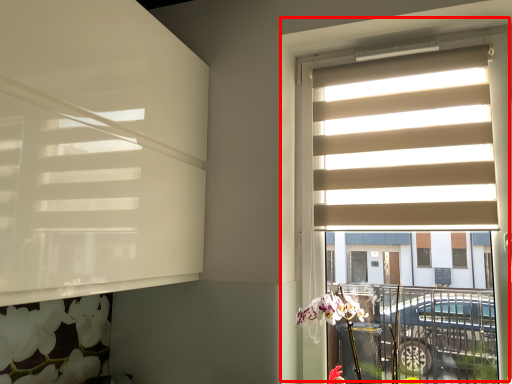
Question: From the image's perspective, what is the correct spatial relationship of window (annotated by the red box) in relation to window blind?

Choices:
 (A) above
 (B) below

Answer: (B)